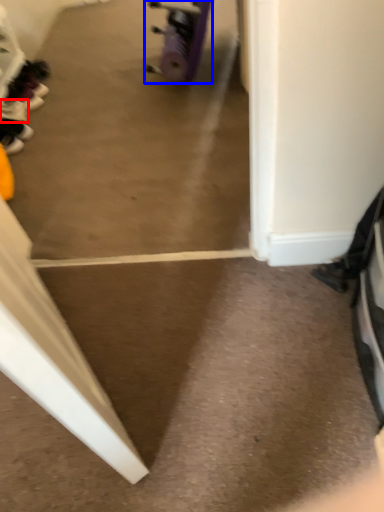
Question: Which object is further to the camera taking this photo, footwear (highlighted by a red box) or wheel (highlighted by a blue box)?

Choices:
 (A) footwear
 (B) wheel

Answer: (A)